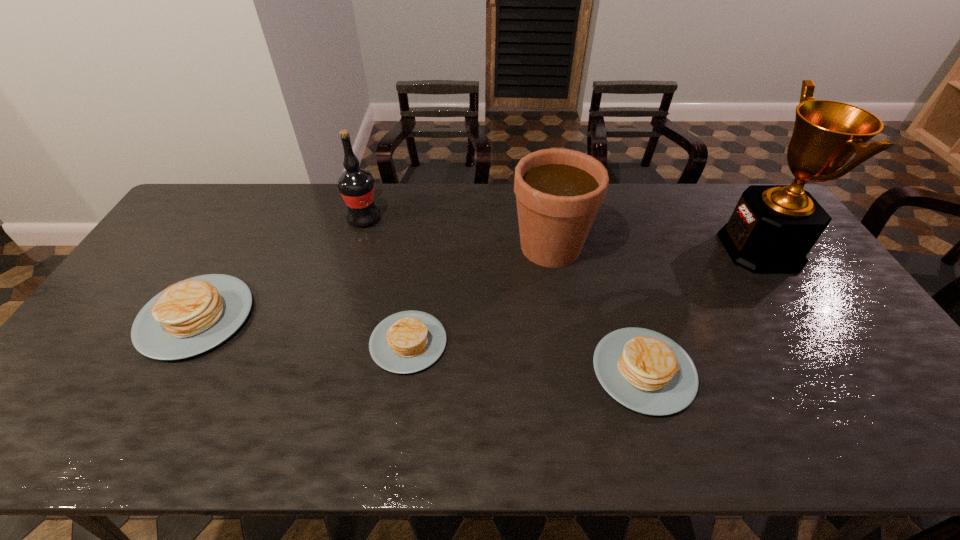
This screenshot has width=960, height=540. I want to click on free space that is in between the tallest object and the second pancake from left to right, so click(585, 295).

At what (x,y) coordinates should I click in order to perform the action: click on vacant space that's between the leftmost pancake and the trophy cup. Please return your answer as a coordinate pair (x, y). This screenshot has height=540, width=960. Looking at the image, I should click on (478, 283).

Where is `vacant area that lies between the shortest pancake and the tallest object`? Image resolution: width=960 pixels, height=540 pixels. vacant area that lies between the shortest pancake and the tallest object is located at coordinates (585, 295).

The height and width of the screenshot is (540, 960). In order to click on unoccupied position between the fourth shortest object and the second shortest object in this screenshot , I will do `click(597, 309)`.

Find the location of `vacant space that is in between the wine bottle and the flowerpot`. vacant space that is in between the wine bottle and the flowerpot is located at coordinates (457, 233).

Find the location of a particular element. free space between the second shortest object and the shortest pancake is located at coordinates (526, 356).

The image size is (960, 540). What are the coordinates of `blank region between the shortest pancake and the tallest object` in the screenshot? It's located at (585, 295).

You are a GUI agent. You are given a task and a screenshot of the screen. Output one action in this format:
    pyautogui.click(x=<x>, y=<y>)
    Task: Click on the free space between the second shortest pancake and the tallest object
    This screenshot has height=540, width=960.
    Given the screenshot: What is the action you would take?
    pyautogui.click(x=702, y=310)

Where is `empty space between the second pancake from left to right and the fourth shortest object`? empty space between the second pancake from left to right and the fourth shortest object is located at coordinates (479, 295).

The height and width of the screenshot is (540, 960). I want to click on object that is the fifth closest to the wine bottle, so click(x=772, y=229).